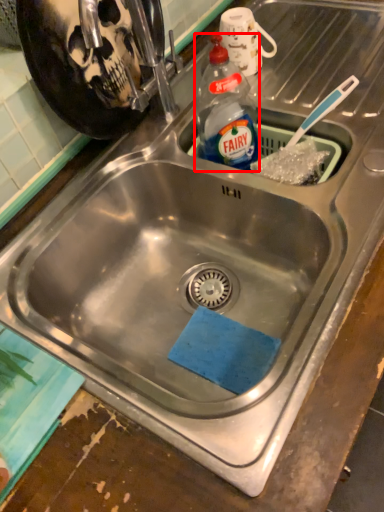
Question: In this image, where is bottle (annotated by the red box) located relative to mug?

Choices:
 (A) right
 (B) left

Answer: (B)